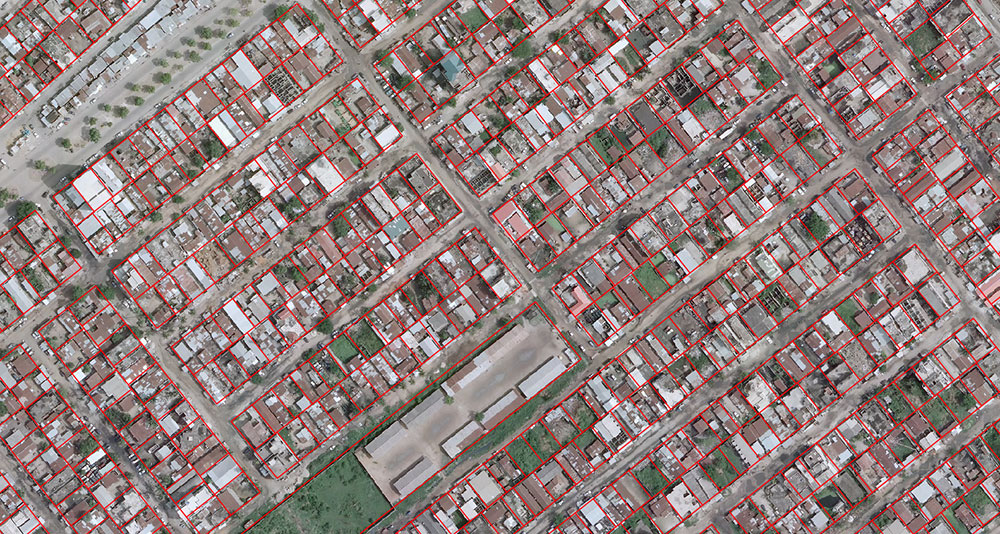
Find the location of `homes`. homes is located at coordinates (611, 425), (602, 392).